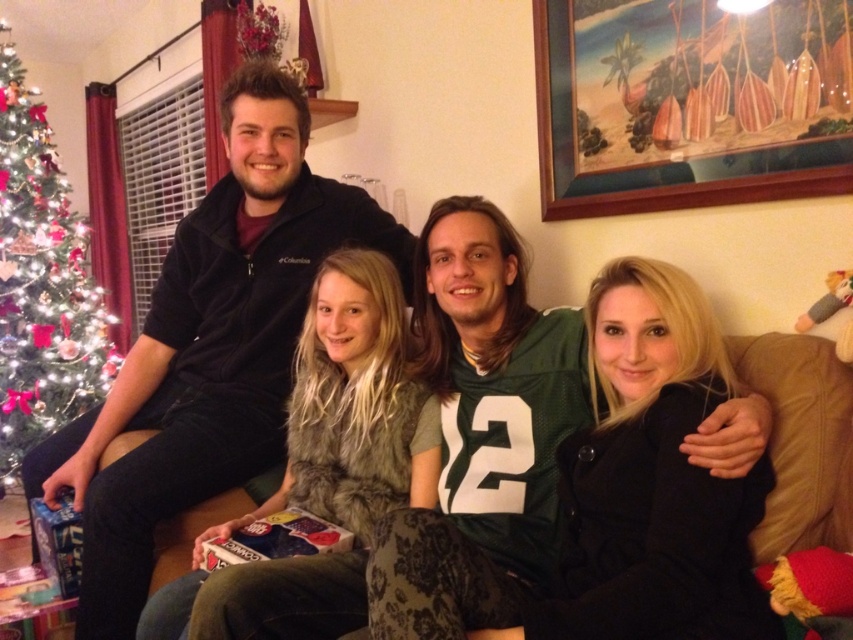
Question: Which point is farther to the camera?

Choices:
 (A) green artificial christmas tree at left
 (B) wooden picture frame at upper right
 (C) brown fabric couch at center

Answer: (A)

Question: In this image, where is wooden picture frame at upper right located relative to brown fabric couch at center?

Choices:
 (A) above
 (B) below

Answer: (A)

Question: Estimate the real-world distances between objects in this image. Which object is farther from the brown fabric couch at center?

Choices:
 (A) green artificial christmas tree at left
 (B) wooden picture frame at upper right

Answer: (A)

Question: Is wooden picture frame at upper right to the left of green artificial christmas tree at left from the viewer's perspective?

Choices:
 (A) no
 (B) yes

Answer: (A)

Question: Can you confirm if wooden picture frame at upper right is positioned to the right of brown fabric couch at center?

Choices:
 (A) yes
 (B) no

Answer: (A)

Question: Among these points, which one is nearest to the camera?

Choices:
 (A) (231, 493)
 (B) (55, 358)
 (C) (723, 141)

Answer: (C)